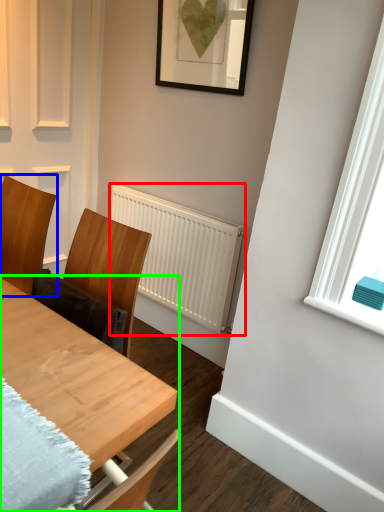
Question: Which object is the closest to the radiator (highlighted by a red box)? Choose among these: chair (highlighted by a blue box) or table (highlighted by a green box).

Choices:
 (A) chair
 (B) table

Answer: (A)